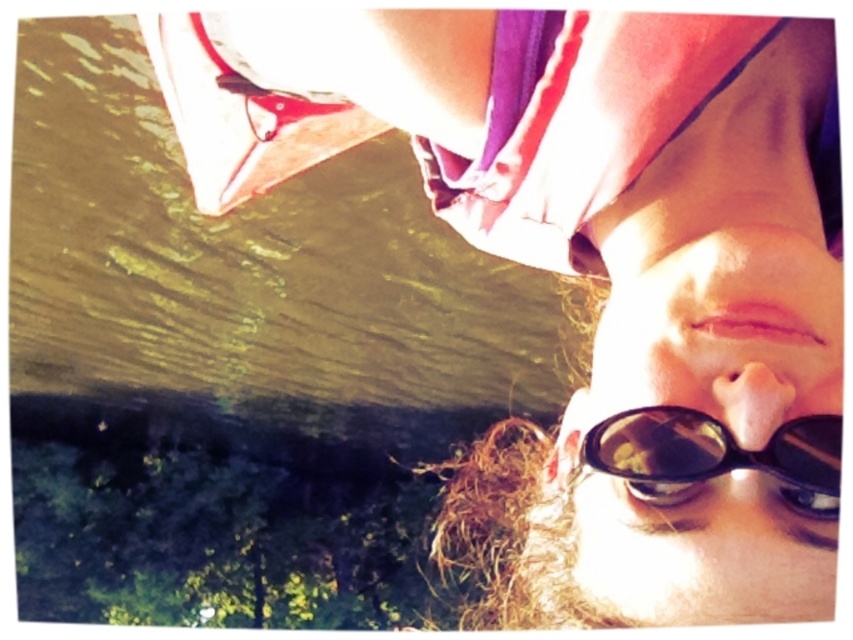
You are a photographer analyzing the selfie. You notice a point marked at coordinates (578, 122). Based on the scene description, what object is located at that point?

The point at coordinates (578, 122) corresponds to the purple silky headscarf at upper center.

You are a photographer analyzing the composition of this selfie. You need to determine the spatial relationship between the purple silky headscarf at upper center and the black matte sunglasses at lower center. Which object is positioned to the left of the other?

The purple silky headscarf at upper center is to the left of black matte sunglasses at lower center.

You are a photographer analyzing the composition of this selfie. You need to determine the vertical positioning of the purple silky headscarf at upper center and the black matte sunglasses at lower center. Which object is placed higher in the image?

The purple silky headscarf at upper center is taller than the black matte sunglasses at lower center, so the headscarf is positioned higher in the image.